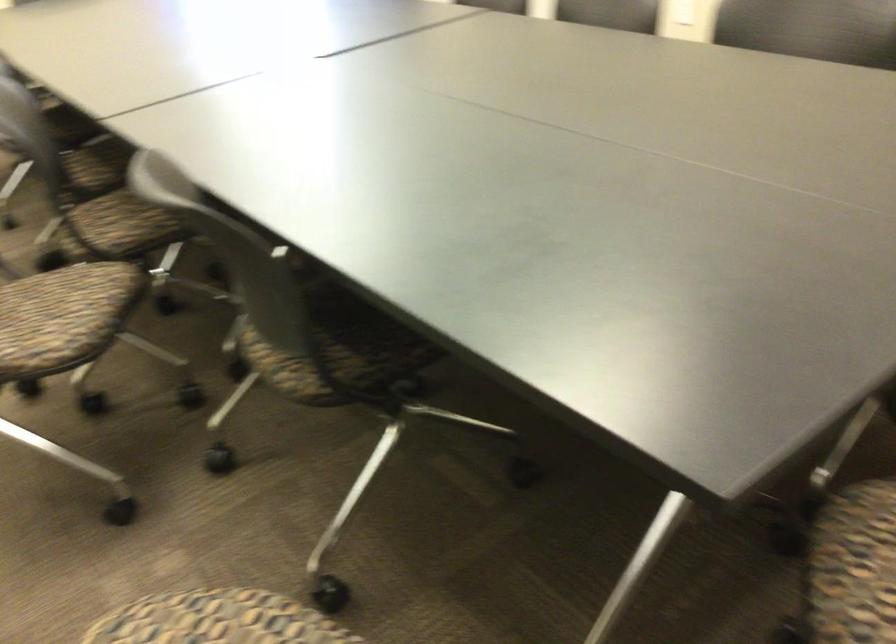
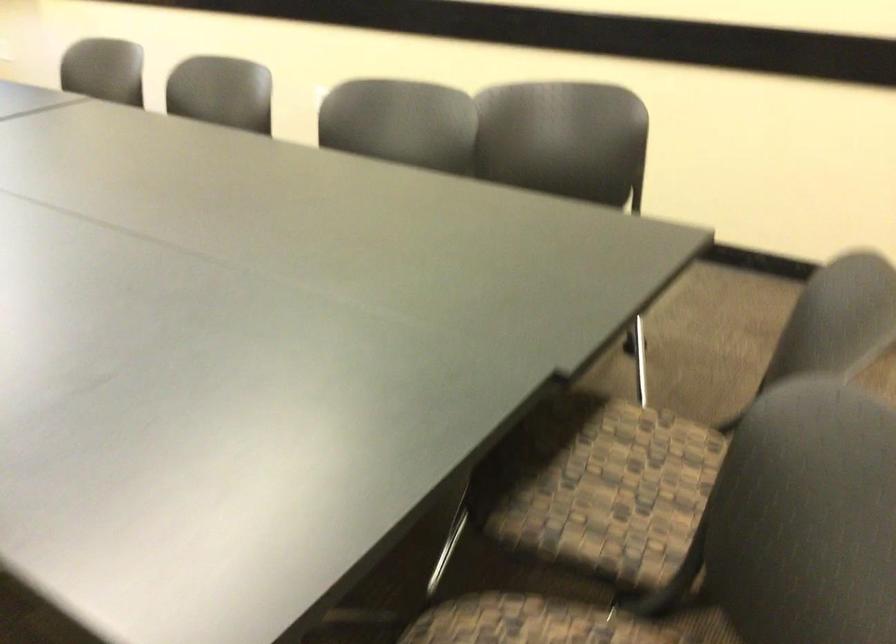
Question: Which direction would the cameraman need to move to produce the second image? Reply with the corresponding letter.

Choices:
 (A) Left
 (B) Right
 (C) Forward
 (D) Backward

Answer: (B)